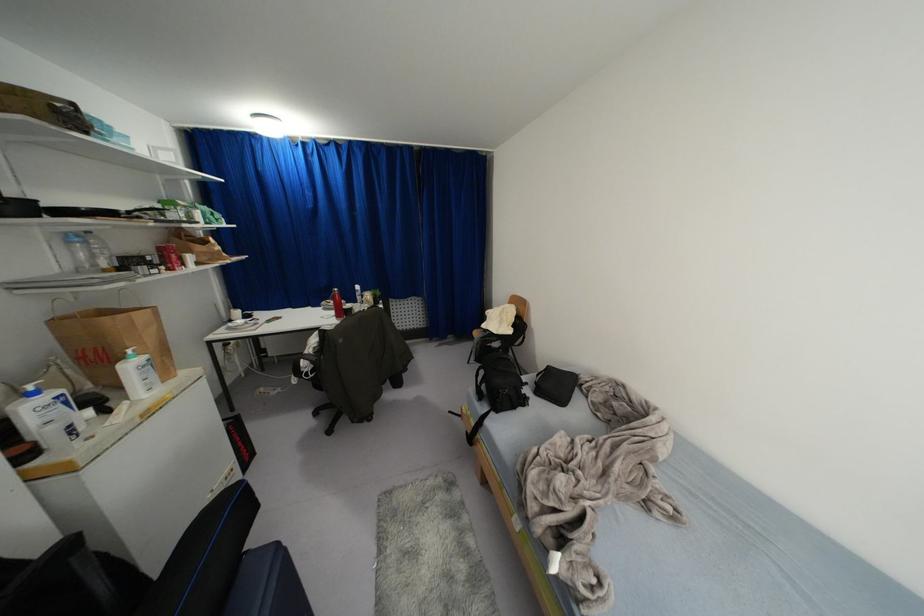
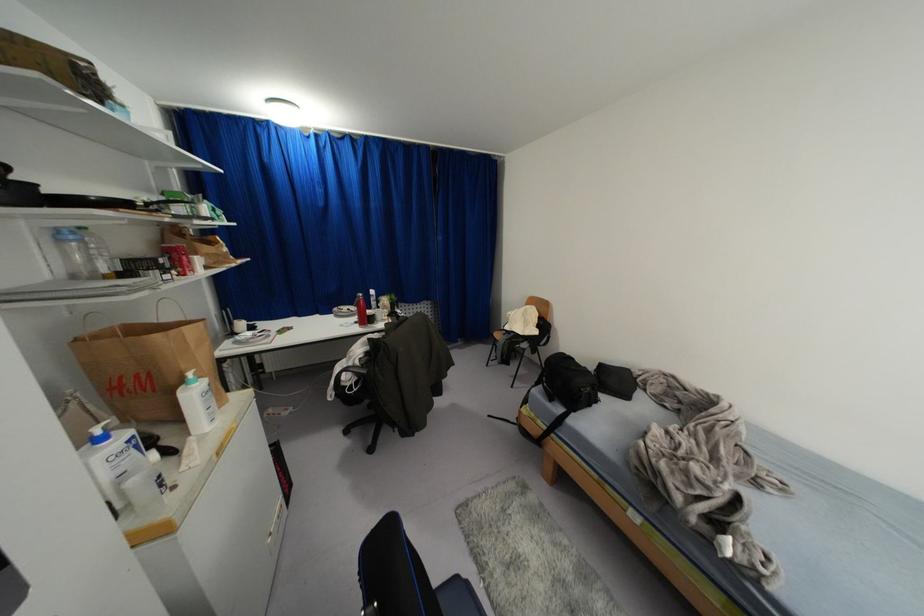
Locate, in the second image, the point that corresponds to point 68,241 in the first image.

(62, 240)